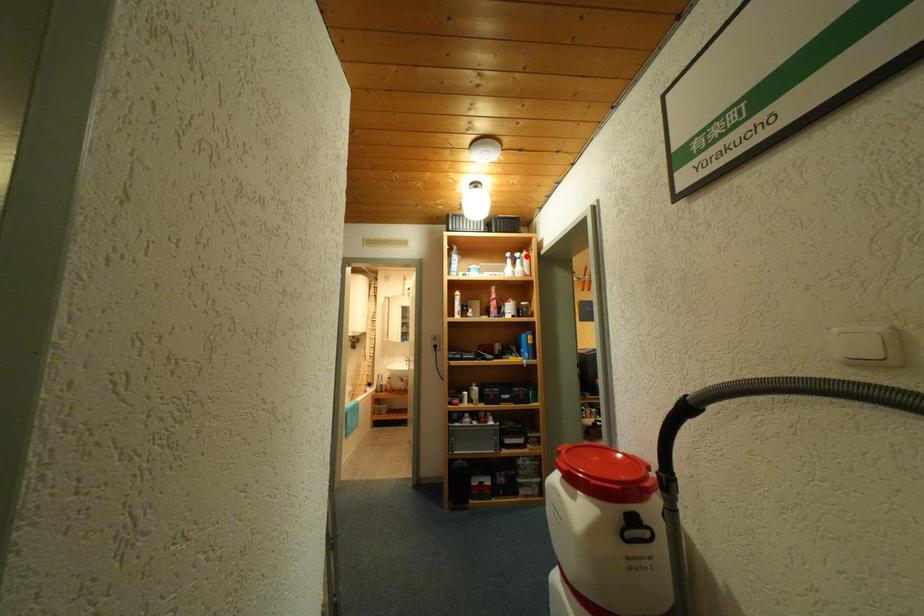
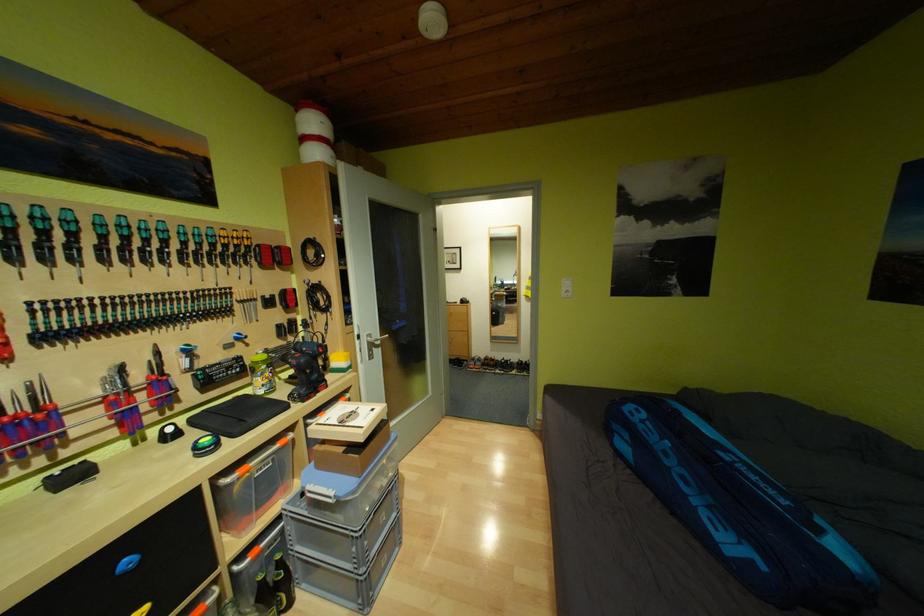
Question: I am providing you with two images of the same scene from different viewpoints. A red point is marked on the first image. At the location where the point appears in image 1, is it still visible in image 2?

Choices:
 (A) Yes
 (B) No

Answer: (B)